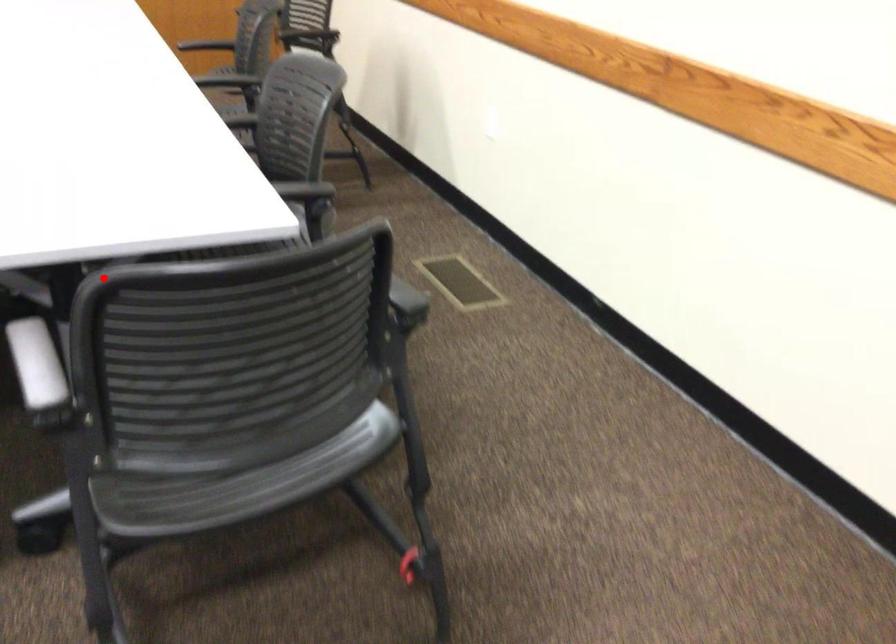
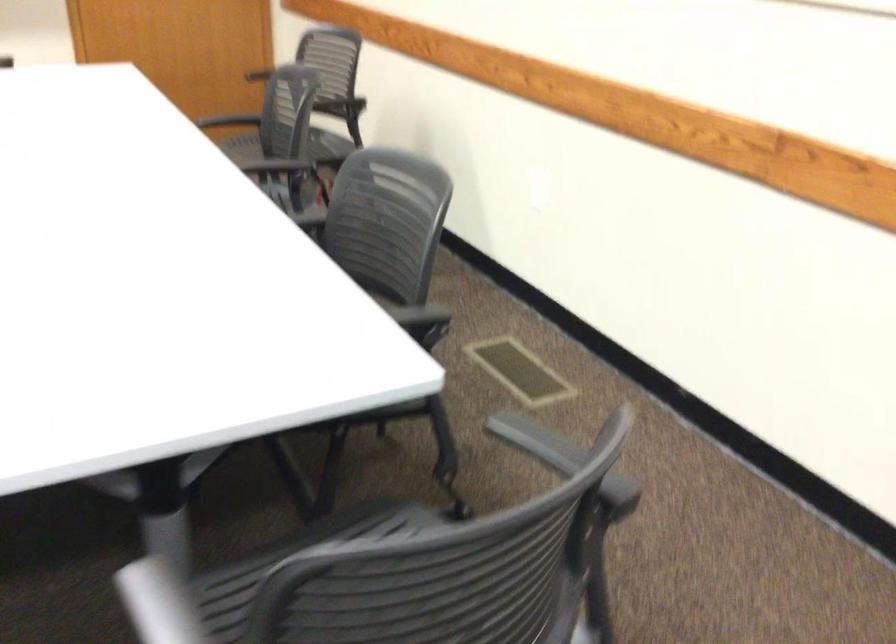
In the second image, find the point that corresponds to the highlighted location in the first image.

(293, 560)